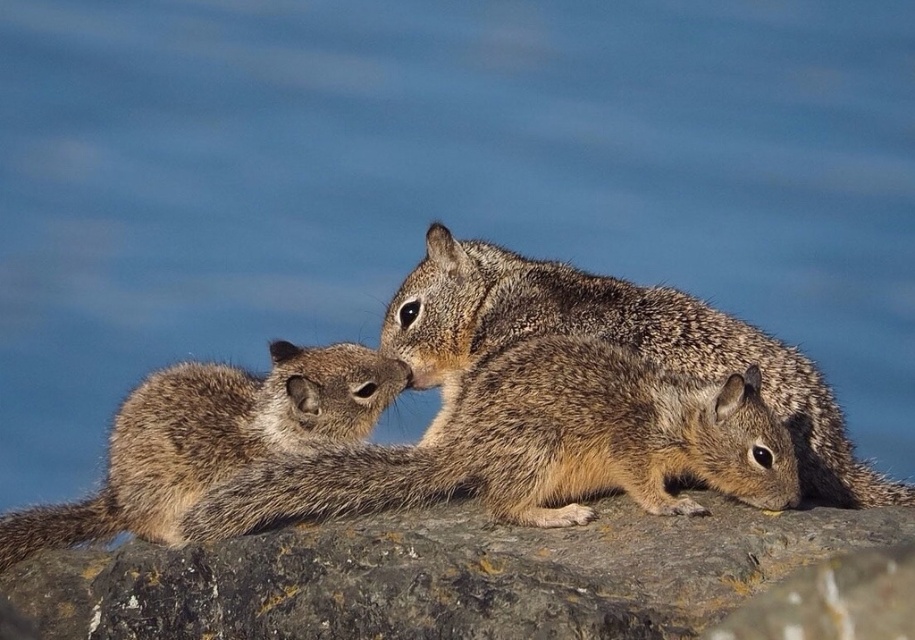
You are a geologist examining a rock sample located at point (x=443, y=576). Based on the scene description, what is the texture and color of the rock at that coordinate?

The rock at point (x=443, y=576) is described as brown and rough in texture.

You are standing at the center of the rocky surface and see two points marked in the image. Which point is closer to you, point (591, 340) or point (366, 360)?

Point (591, 340) is in front of point (366, 360), so it is closer to you.